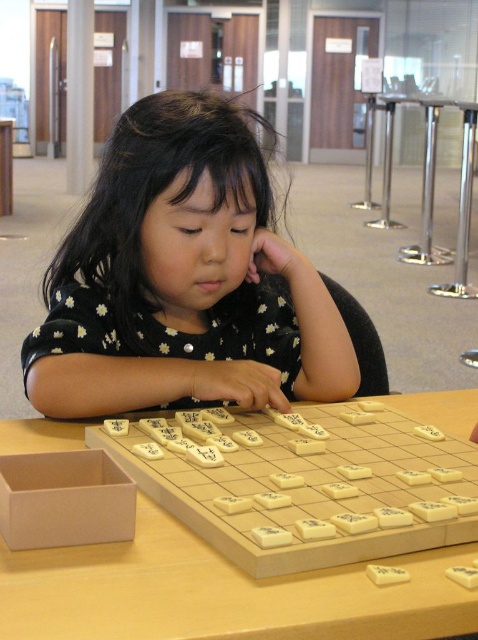
You are a photographer standing at the position of the viewer. You want to take a closeup photo of the black dotted shirt at center without moving the child. Can you do it with a standard camera lens that has a minimum focusing distance of 30 inches?

The black dotted shirt at center and viewer are 32.93 inches apart from each other. Since the minimum focusing distance of the camera lens is 30 inches, the photographer can take the closeup photo because 32.93 inches is greater than 30 inches.

From the picture: You are a photographer trying to capture a closeup of the wooden at center while ensuring the black dotted shirt at center is still visible in the background. Is this possible given their positions?

The black dotted shirt at center is further to the viewer than wooden at center, so the wooden at center would be in front of the black dotted shirt at center. Therefore, it would be difficult to have the black dotted shirt at center visible in the background while focusing on the wooden at center.